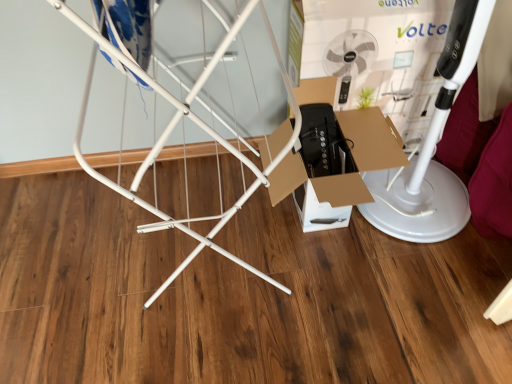
The image size is (512, 384). I want to click on blank area to the left of cardboard box at center, so click(223, 226).